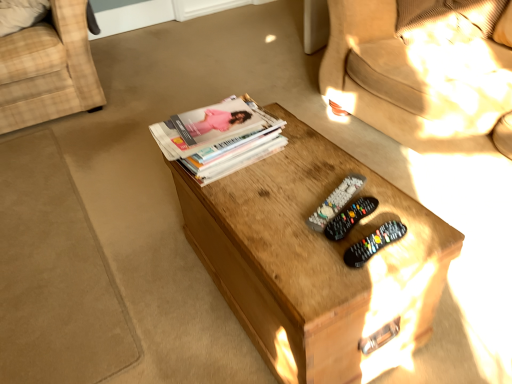
What are the coordinates of `free space between black plastic remote controls at center, which ranks as the first remote control in front-to-back order, and white glossy magazine stack at center` in the screenshot? It's located at (275, 183).